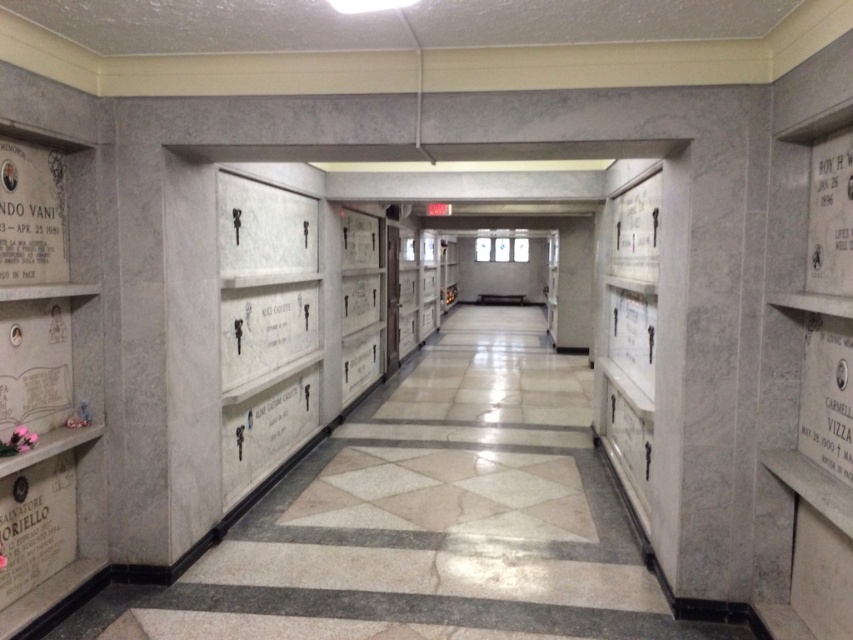
You are an interior designer tasked with placing a new 1.2 meter wide decorative shelf in the crematorium hallway. The shelf must be placed between the white marble crypts at left and the black marble plaque at left. Can the shelf fit without overlapping either object?

The white marble crypts at left are wider than the black marble plaque at left. Since the shelf is 1.2 meters wide, it depends on the exact spacing between them. However, since the crypts are wider, there might not be enough space. Without specific measurements, it is uncertain.

You are standing in the hallway and want to touch the black marble plaque at left. Can you reach it without moving the white marble crypts at left?

The black marble plaque at left is behind the white marble crypts at left, so you cannot reach it without moving the white marble crypts at left.